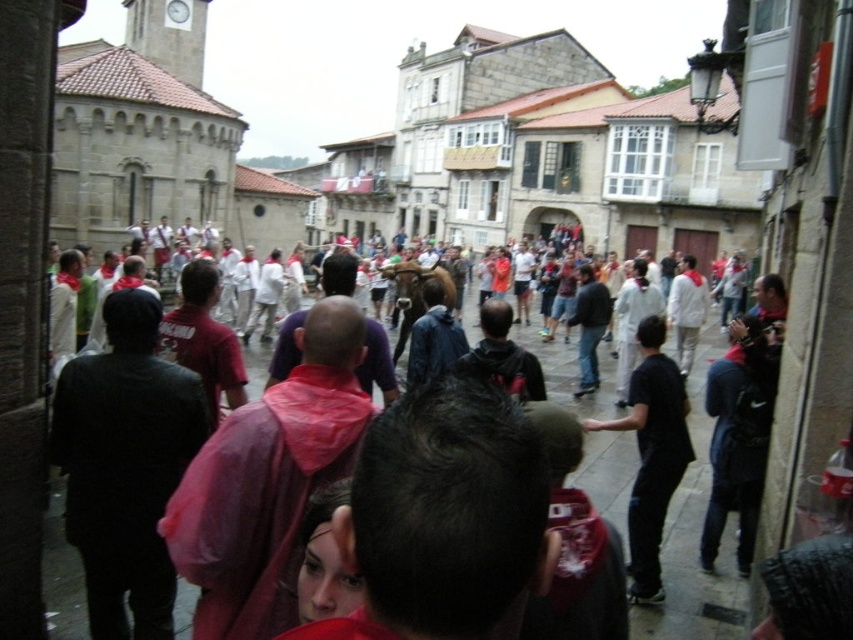
Question: Is pink raincoat at center positioned at the back of black matte shirt at center?

Choices:
 (A) no
 (B) yes

Answer: (A)

Question: Is pink raincoat at center bigger than black matte shirt at center?

Choices:
 (A) no
 (B) yes

Answer: (B)

Question: Which object is closer to the camera taking this photo?

Choices:
 (A) black matte shirt at center
 (B) pink raincoat at center

Answer: (B)

Question: Is pink raincoat at center bigger than black matte shirt at center?

Choices:
 (A) no
 (B) yes

Answer: (B)

Question: Which object appears farthest from the camera in this image?

Choices:
 (A) pink raincoat at center
 (B) black matte shirt at center

Answer: (B)